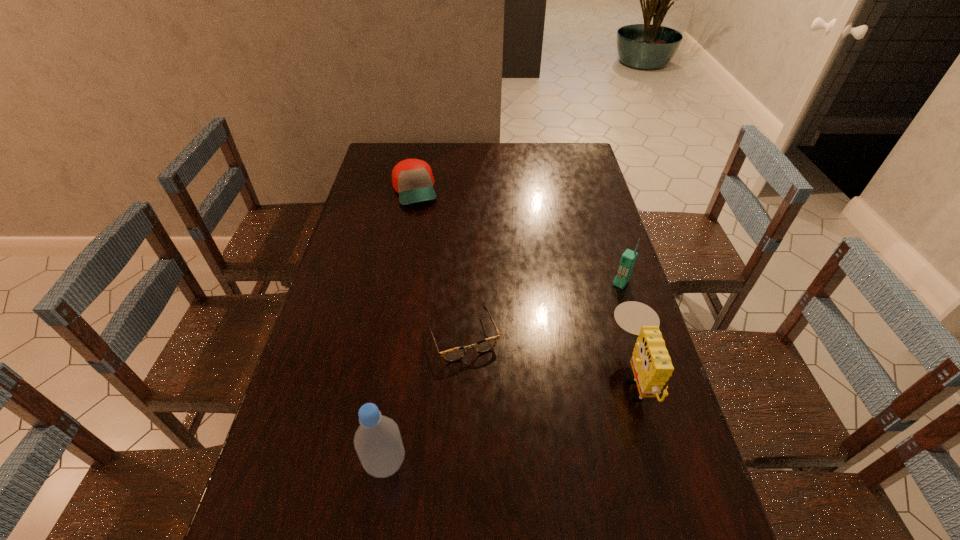
Identify the location of vacant space located on the front-facing side of the sponge. (452, 376).

Where is `free location located on the front-facing side of the sponge`? free location located on the front-facing side of the sponge is located at coordinates (580, 376).

Locate an element on the screen. The image size is (960, 540). blank space located at the brim of the fourth tallest object is located at coordinates (421, 217).

Locate an element on the screen. Image resolution: width=960 pixels, height=540 pixels. vacant space situated 0.200m at the brim of the fourth tallest object is located at coordinates (430, 244).

Image resolution: width=960 pixels, height=540 pixels. In order to click on vacant space located 0.300m at the brim of the fourth tallest object in this screenshot , I will do `click(436, 263)`.

Where is `blank space located on the frame of the third object from right to left`? blank space located on the frame of the third object from right to left is located at coordinates [x=516, y=462].

Image resolution: width=960 pixels, height=540 pixels. In order to click on vacant space situated 0.370m on the frame of the third object from right to left in this screenshot , I will do `click(536, 509)`.

You are a GUI agent. You are given a task and a screenshot of the screen. Output one action in this format:
    pyautogui.click(x=<x>, y=<y>)
    Task: Click on the free space located 0.160m on the frame of the third object from right to left
    This screenshot has height=540, width=960.
    Given the screenshot: What is the action you would take?
    pyautogui.click(x=498, y=417)

This screenshot has height=540, width=960. Find the location of `blank space located on the keypad of the cellular telephone`. blank space located on the keypad of the cellular telephone is located at coordinates (551, 374).

At what (x,y) coordinates should I click in order to perform the action: click on vacant space positioned on the keypad of the cellular telephone. Please return your answer as a coordinate pair (x, y). Image resolution: width=960 pixels, height=540 pixels. Looking at the image, I should click on (576, 341).